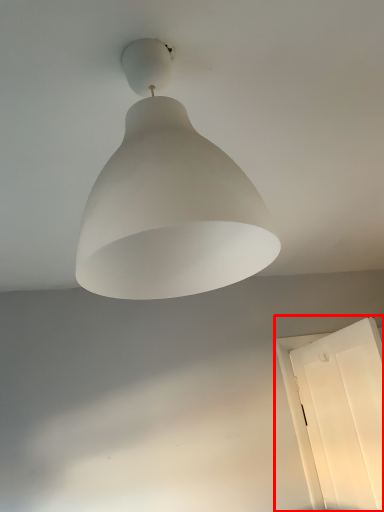
Question: Observing the image, what is the correct spatial positioning of window (annotated by the red box) in reference to lamp?

Choices:
 (A) right
 (B) left

Answer: (A)